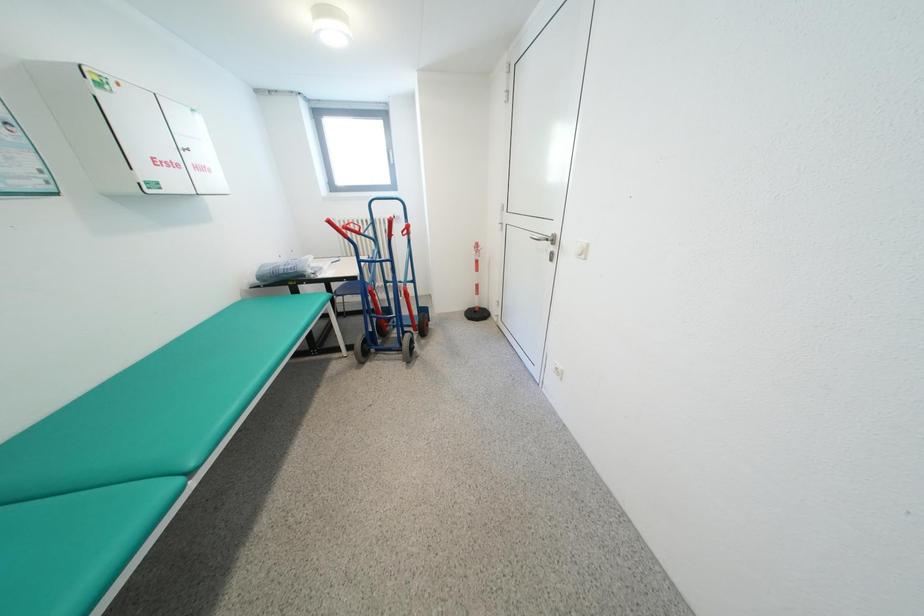
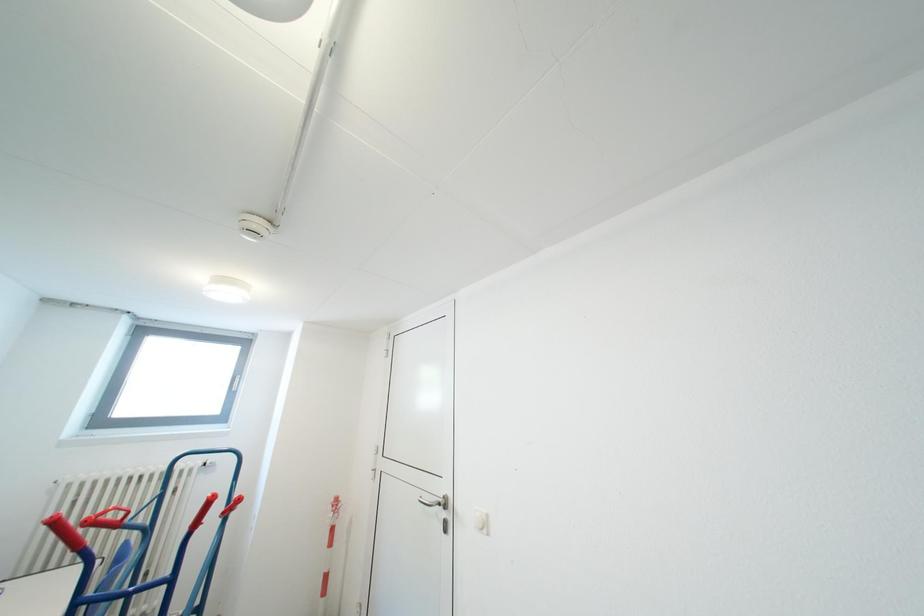
First-person continuous shooting, in which direction is the camera rotating?

The rotation direction of the camera is right-up.